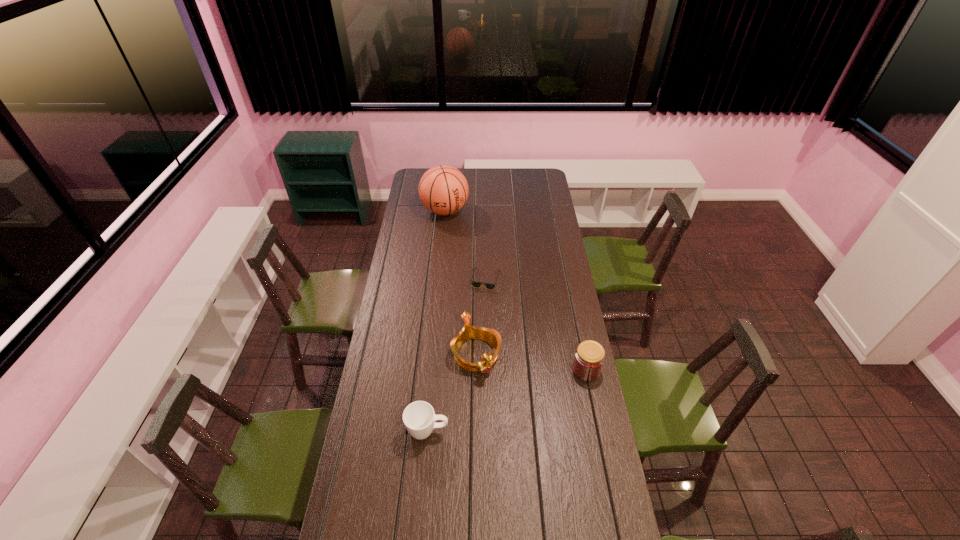
You are a GUI agent. You are given a task and a screenshot of the screen. Output one action in this format:
    pyautogui.click(x=<x>, y=<y>)
    Task: Click on the vacant area located 0.160m on the lenses of the shortest object
    The width and height of the screenshot is (960, 540).
    Given the screenshot: What is the action you would take?
    pyautogui.click(x=500, y=314)

This screenshot has width=960, height=540. I want to click on vacant space located 0.280m on the lenses of the shortest object, so click(x=509, y=333).

Identify the location of free space located 0.280m on the surface of the tallest object near the brand logo. (465, 255).

Locate an element on the screen. The height and width of the screenshot is (540, 960). vacant space positioned 0.220m on the surface of the tallest object near the brand logo is located at coordinates (462, 248).

Locate an element on the screen. The image size is (960, 540). vacant space positioned on the surface of the tallest object near the brand logo is located at coordinates (470, 267).

Find the location of `vacant area situated at the front emblem of the tiara`. vacant area situated at the front emblem of the tiara is located at coordinates (504, 417).

This screenshot has height=540, width=960. In order to click on vacant space situated 0.140m at the front emblem of the tiara in this screenshot , I will do `click(499, 407)`.

The height and width of the screenshot is (540, 960). Find the location of `vacant position located at the front emblem of the tiara`. vacant position located at the front emblem of the tiara is located at coordinates (497, 402).

I want to click on object that is positioned at the left edge, so click(443, 190).

This screenshot has width=960, height=540. Find the location of `object situated at the right edge`. object situated at the right edge is located at coordinates (589, 357).